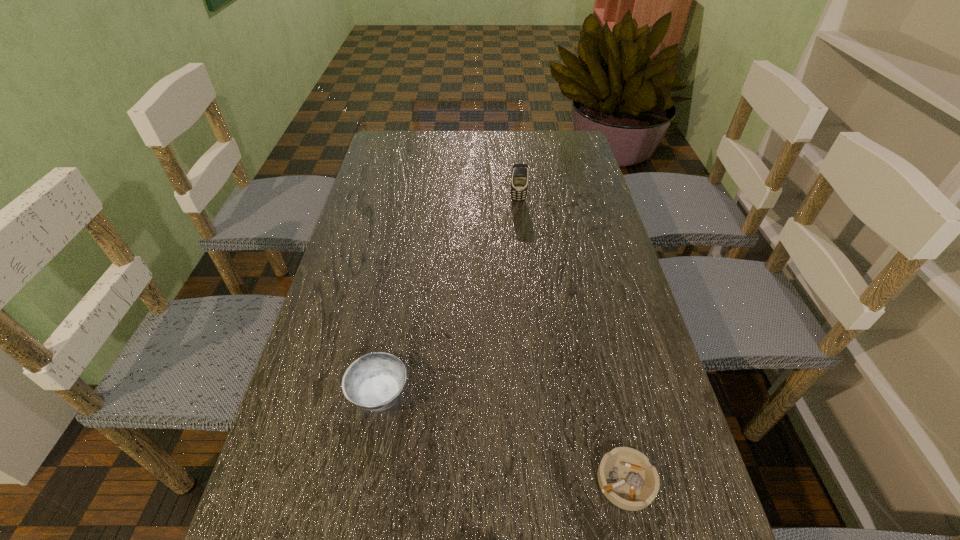
Find the location of `ashtray that is the second closest to the tallest object`. ashtray that is the second closest to the tallest object is located at coordinates (627, 479).

The width and height of the screenshot is (960, 540). What are the coordinates of `blank area in the image that satisfies the following two spatial constraints: 1. on the front face of the rightmost object; 2. on the left side of the cellular telephone` in the screenshot? It's located at (548, 481).

Identify the location of blank space that satisfies the following two spatial constraints: 1. on the front side of the right ashtray; 2. on the left side of the left ashtray. The width and height of the screenshot is (960, 540). (364, 481).